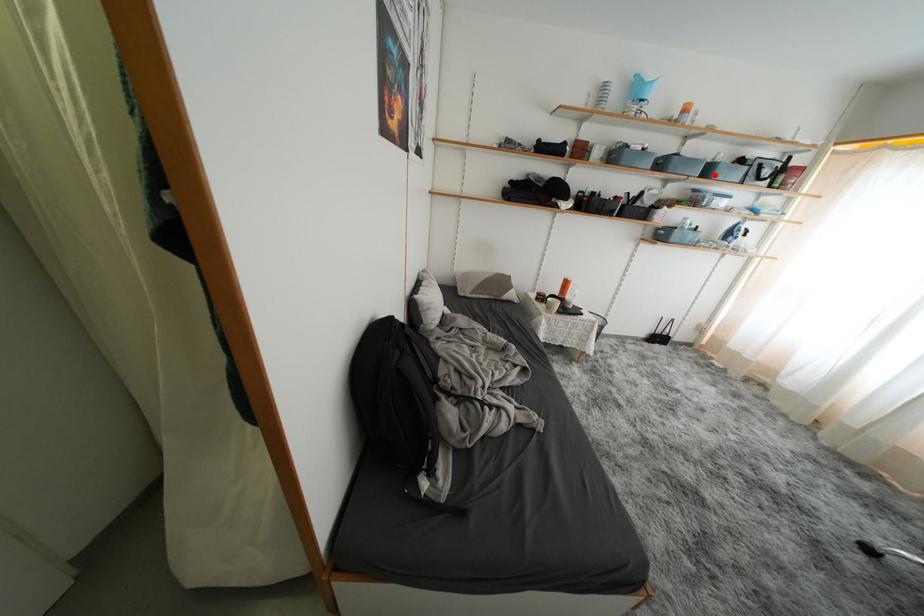
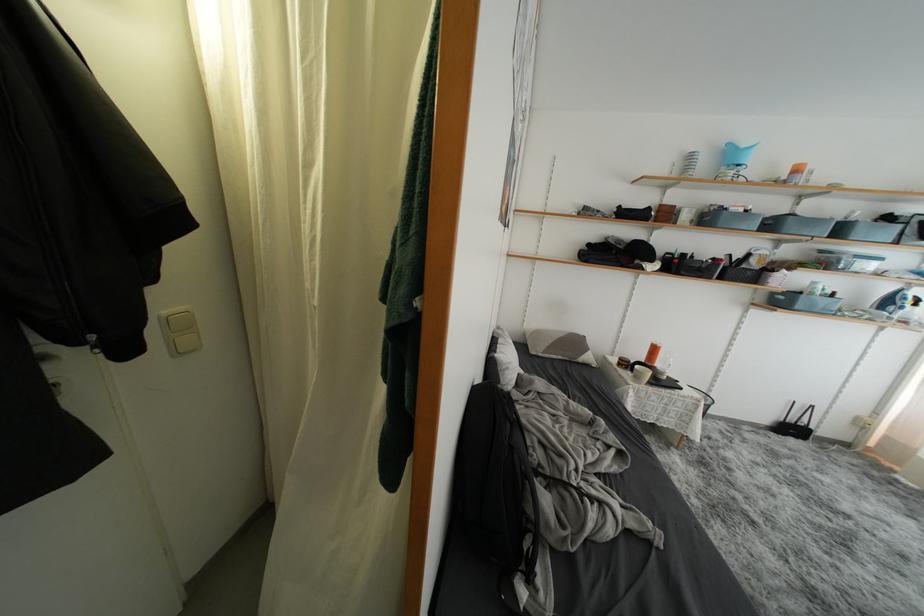
Where in the second image is the point corresponding to the highlighted location from the first image?

(847, 235)